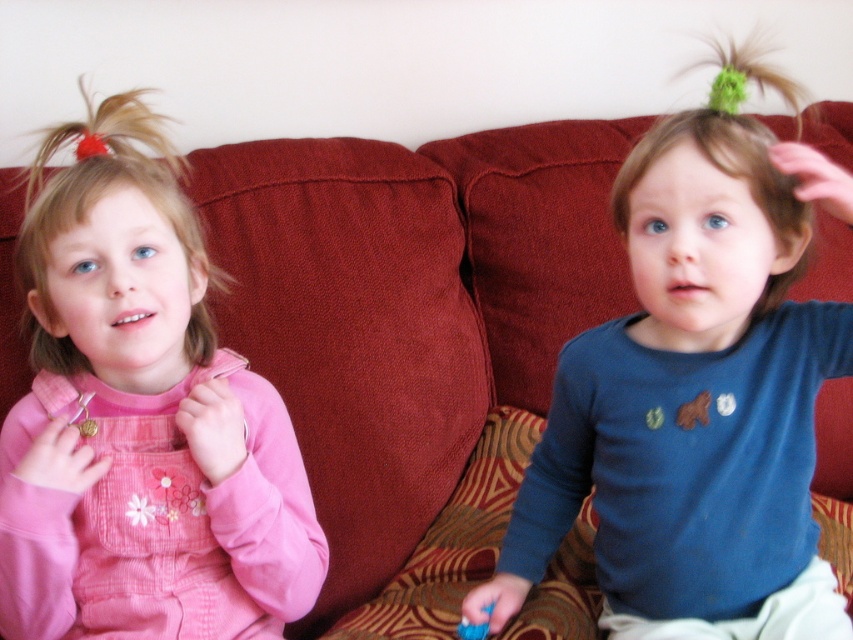
Question: In this image, where is blue cotton shirt at center located relative to pink corduroy dress at left?

Choices:
 (A) above
 (B) below

Answer: (A)

Question: Which of the following is the closest to the observer?

Choices:
 (A) (134, 168)
 (B) (254, 406)
 (C) (473, 632)

Answer: (A)

Question: Which of the following is the farthest from the observer?

Choices:
 (A) pink corduroy dress at left
 (B) blonde corduroy hair at left
 (C) blue plastic brush at lower center

Answer: (C)

Question: Considering the real-world distances, which object is farthest from the brown fuzzy hair at upper right?

Choices:
 (A) blonde corduroy hair at left
 (B) blue plastic brush at lower center
 (C) blue cotton shirt at center
 (D) pink corduroy dress at left

Answer: (B)

Question: In this image, where is blonde corduroy hair at left located relative to blue plastic brush at lower center?

Choices:
 (A) below
 (B) above

Answer: (B)

Question: Is pink corduroy dress at left further to the viewer compared to blonde corduroy hair at left?

Choices:
 (A) yes
 (B) no

Answer: (B)